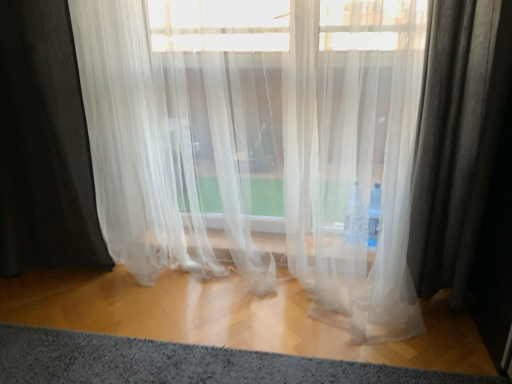
Question: Is gray soft rug at lower center surrounding translucent white curtain at center?

Choices:
 (A) yes
 (B) no

Answer: (B)

Question: From the image's perspective, is gray soft rug at lower center above translucent white curtain at center?

Choices:
 (A) yes
 (B) no

Answer: (B)

Question: Is there a large distance between gray soft rug at lower center and translucent white curtain at center?

Choices:
 (A) no
 (B) yes

Answer: (A)

Question: Could you tell me if gray soft rug at lower center is facing translucent white curtain at center?

Choices:
 (A) yes
 (B) no

Answer: (B)

Question: Can you confirm if gray soft rug at lower center is wider than translucent white curtain at center?

Choices:
 (A) no
 (B) yes

Answer: (A)

Question: From the image's perspective, is gray soft rug at lower center beneath translucent white curtain at center?

Choices:
 (A) no
 (B) yes

Answer: (B)

Question: From the image's perspective, is translucent white curtain at center on top of gray soft rug at lower center?

Choices:
 (A) yes
 (B) no

Answer: (A)

Question: Is translucent white curtain at center looking in the opposite direction of gray soft rug at lower center?

Choices:
 (A) no
 (B) yes

Answer: (A)

Question: Considering the relative sizes of translucent white curtain at center and gray soft rug at lower center in the image provided, is translucent white curtain at center shorter than gray soft rug at lower center?

Choices:
 (A) yes
 (B) no

Answer: (B)

Question: Does translucent white curtain at center turn towards gray soft rug at lower center?

Choices:
 (A) no
 (B) yes

Answer: (B)

Question: Is translucent white curtain at center in contact with gray soft rug at lower center?

Choices:
 (A) no
 (B) yes

Answer: (A)

Question: Is translucent white curtain at center positioned before gray soft rug at lower center?

Choices:
 (A) no
 (B) yes

Answer: (A)

Question: From a real-world perspective, relative to gray soft rug at lower center, is translucent white curtain at center vertically above or below?

Choices:
 (A) above
 (B) below

Answer: (A)